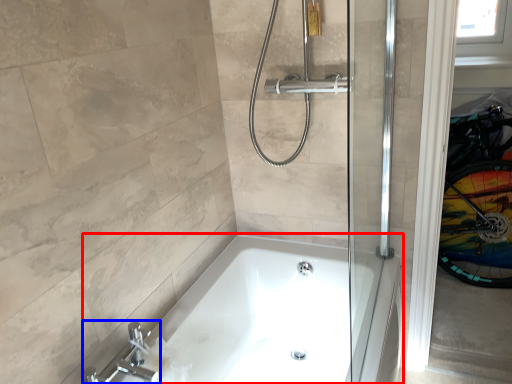
Question: Which point is further to the camera, bathtub (highlighted by a red box) or tap (highlighted by a blue box)?

Choices:
 (A) bathtub
 (B) tap

Answer: (B)